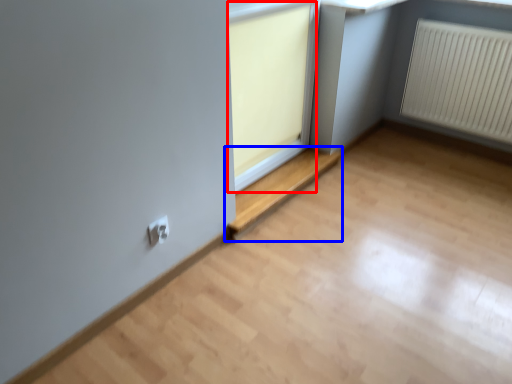
Question: Which of the following is the farthest to the observer, window frame (highlighted by a red box) or window (highlighted by a blue box)?

Choices:
 (A) window frame
 (B) window

Answer: (B)